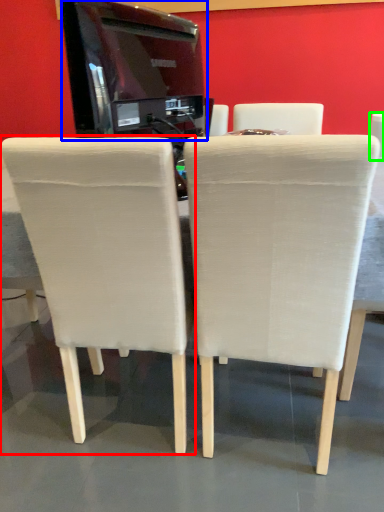
Question: Which object is positioned closest to chair (highlighted by a red box)? Select from appliance (highlighted by a blue box) and chair (highlighted by a green box).

Choices:
 (A) appliance
 (B) chair

Answer: (A)